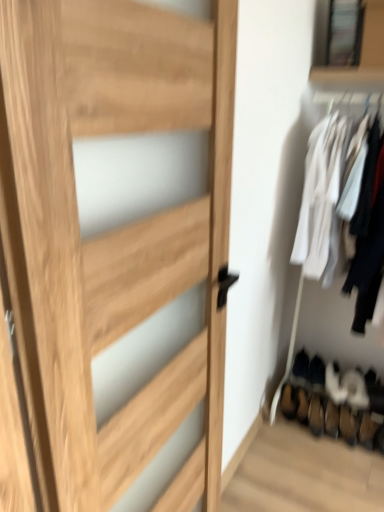
Question: Considering the positions of brown suede shoe at lower right, the first shoe positioned from the left, and white suede shoe at lower right, the 1th shoe positioned from the right, in the image, is brown suede shoe at lower right, the first shoe positioned from the left, wider or thinner than white suede shoe at lower right, the 1th shoe positioned from the right,?

Choices:
 (A) thin
 (B) wide

Answer: (A)

Question: Considering the positions of brown suede shoe at lower right, which ranks as the fifth shoe in right-to-left order, and white suede shoe at lower right, which is the fifth shoe in left-to-right order, in the image, is brown suede shoe at lower right, which ranks as the fifth shoe in right-to-left order, taller or shorter than white suede shoe at lower right, which is the fifth shoe in left-to-right order,?

Choices:
 (A) tall
 (B) short

Answer: (B)

Question: Which of these objects is positioned farthest from the white suede shoe at lower right, the 3th shoe from the right?

Choices:
 (A) white suede shoe at lower right, which is the fifth shoe in left-to-right order
 (B) black suede shoe at lower right, which ranks as the 2th shoe in left-to-right order
 (C) brown suede shoe at lower right, the first shoe positioned from the left
 (D) natural wood door at center
 (E) white suede shoe at lower right, placed as the fourth shoe when sorted from left to right

Answer: (D)

Question: Which object is positioned farthest from the brown suede shoe at lower right, which ranks as the fifth shoe in right-to-left order?

Choices:
 (A) white suede shoe at lower right, placed as the fourth shoe when sorted from left to right
 (B) white suede shoe at lower right, which is counted as the 3th shoe, starting from the left
 (C) natural wood door at center
 (D) white suede shoe at lower right, which is the fifth shoe in left-to-right order
 (E) black suede shoe at lower right, which ranks as the 2th shoe in left-to-right order

Answer: (C)